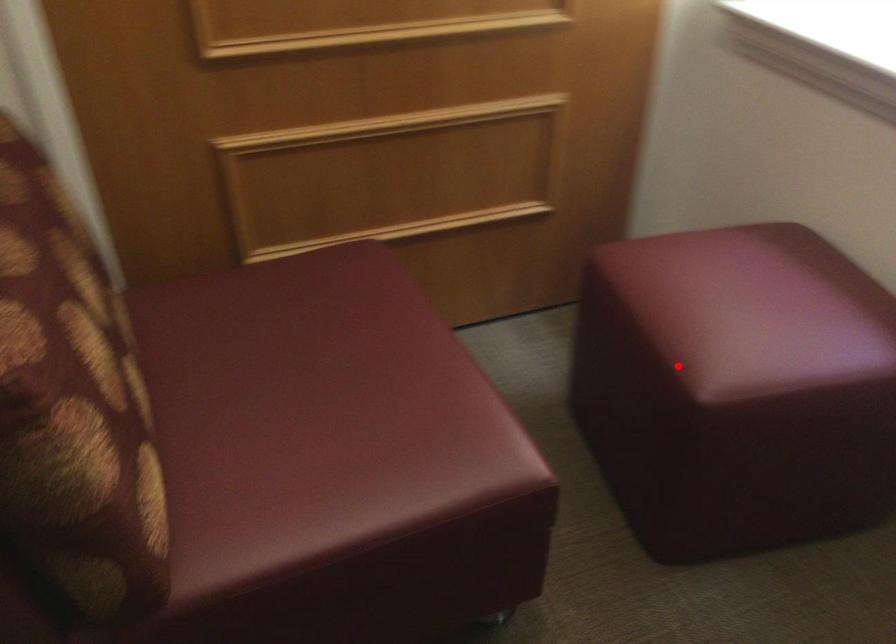
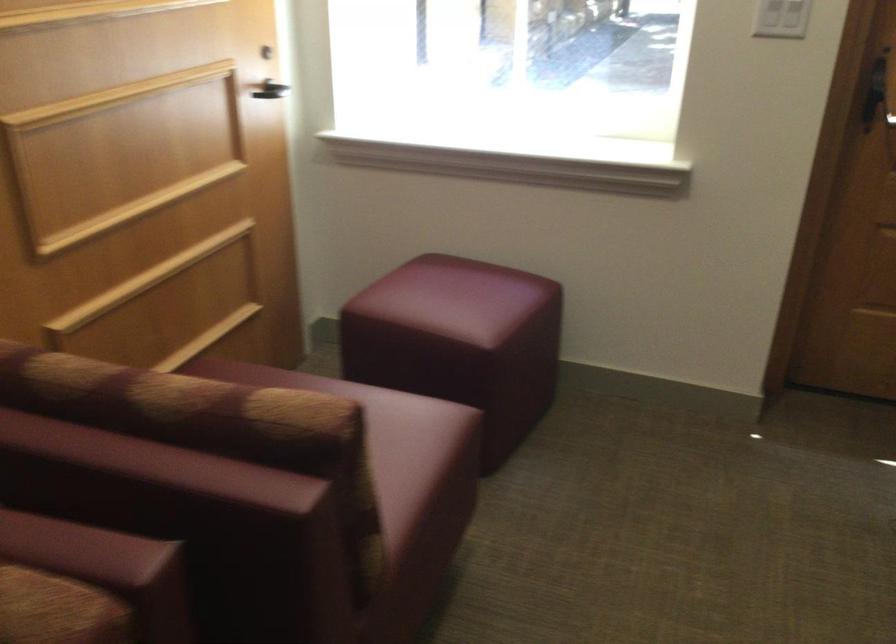
The point at the highlighted location is marked in the first image. Where is the corresponding point in the second image?

(460, 342)